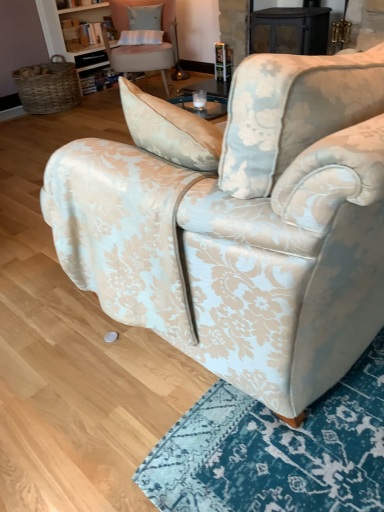
Question: Does floral fabric armchair at center, arranged as the first chair when viewed from the right, have a smaller size compared to pastel pink fabric chair at upper center, which appears as the 1th chair when viewed from the left?

Choices:
 (A) yes
 (B) no

Answer: (B)

Question: Is floral fabric armchair at center, arranged as the first chair when viewed from the right, next to pastel pink fabric chair at upper center, the second chair viewed from the right?

Choices:
 (A) yes
 (B) no

Answer: (B)

Question: Is floral fabric armchair at center, arranged as the first chair when viewed from the right, not inside pastel pink fabric chair at upper center, which appears as the 1th chair when viewed from the left?

Choices:
 (A) no
 (B) yes

Answer: (B)

Question: From the image's perspective, does floral fabric armchair at center, arranged as the first chair when viewed from the right, appear lower than pastel pink fabric chair at upper center, which appears as the 1th chair when viewed from the left?

Choices:
 (A) no
 (B) yes

Answer: (B)

Question: Is floral fabric armchair at center, arranged as the first chair when viewed from the right, at the left side of pastel pink fabric chair at upper center, the second chair viewed from the right?

Choices:
 (A) yes
 (B) no

Answer: (B)

Question: Is there a large distance between floral fabric armchair at center, arranged as the first chair when viewed from the right, and pastel pink fabric chair at upper center, the second chair viewed from the right?

Choices:
 (A) no
 (B) yes

Answer: (B)

Question: Are pastel pink fabric chair at upper center, the second chair viewed from the right, and floral fabric armchair at center, arranged as the first chair when viewed from the right, far apart?

Choices:
 (A) no
 (B) yes

Answer: (B)

Question: Does pastel pink fabric chair at upper center, which appears as the 1th chair when viewed from the left, have a greater width compared to floral fabric armchair at center, arranged as the first chair when viewed from the right?

Choices:
 (A) no
 (B) yes

Answer: (A)

Question: Is pastel pink fabric chair at upper center, which appears as the 1th chair when viewed from the left, looking in the opposite direction of floral fabric armchair at center, positioned as the 2th chair in left-to-right order?

Choices:
 (A) yes
 (B) no

Answer: (B)

Question: Is pastel pink fabric chair at upper center, the second chair viewed from the right, not inside floral fabric armchair at center, positioned as the 2th chair in left-to-right order?

Choices:
 (A) yes
 (B) no

Answer: (A)

Question: Considering the relative positions of pastel pink fabric chair at upper center, the second chair viewed from the right, and floral fabric armchair at center, positioned as the 2th chair in left-to-right order, in the image provided, is pastel pink fabric chair at upper center, the second chair viewed from the right, to the right of floral fabric armchair at center, positioned as the 2th chair in left-to-right order, from the viewer's perspective?

Choices:
 (A) no
 (B) yes

Answer: (A)

Question: Can you confirm if pastel pink fabric chair at upper center, the second chair viewed from the right, is positioned to the left of floral fabric armchair at center, positioned as the 2th chair in left-to-right order?

Choices:
 (A) yes
 (B) no

Answer: (A)

Question: Is pastel pink fabric chair at upper center, which appears as the 1th chair when viewed from the left, situated inside floral fabric armchair at center, arranged as the first chair when viewed from the right, or outside?

Choices:
 (A) inside
 (B) outside

Answer: (B)